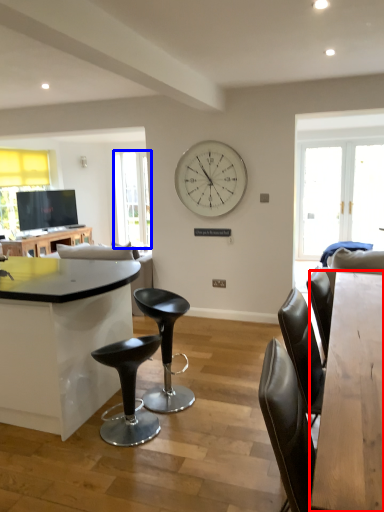
Question: Which object appears farthest to the camera in this image, table (highlighted by a red box) or window screen (highlighted by a blue box)?

Choices:
 (A) table
 (B) window screen

Answer: (B)